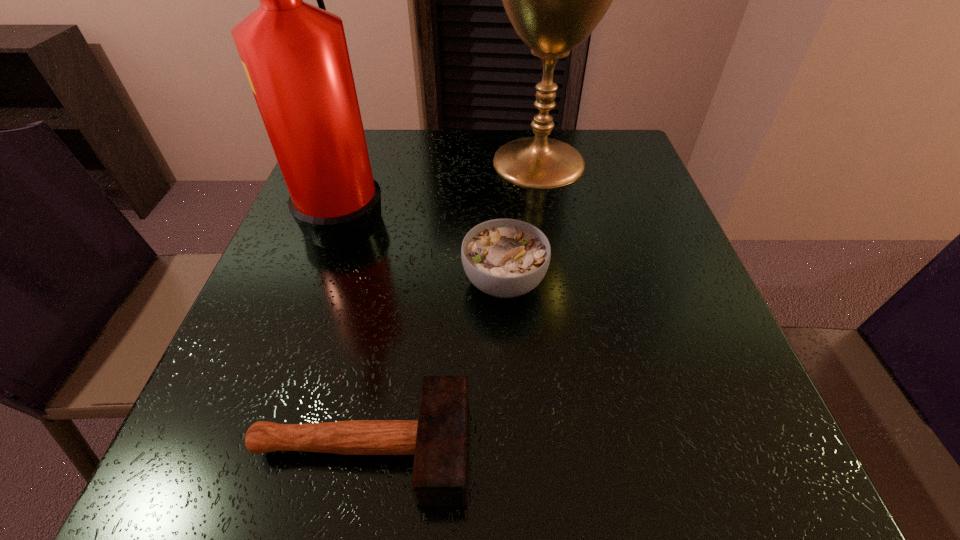
This screenshot has height=540, width=960. I want to click on vacant space in between the fire extinguisher and the second shortest object, so click(x=425, y=246).

Locate an element on the screen. free space between the third tallest object and the fire extinguisher is located at coordinates (425, 246).

Where is `object that stands as the second closest to the second shortest object`? object that stands as the second closest to the second shortest object is located at coordinates (295, 55).

Identify the location of object that is the closest to the mallet. This screenshot has width=960, height=540. (505, 258).

You are a GUI agent. You are given a task and a screenshot of the screen. Output one action in this format:
    pyautogui.click(x=<x>, y=<y>)
    Task: Click on the free location that satisfies the following two spatial constraints: 1. on the front side of the trophy cup; 2. at the spray nozzle of the fire extinguisher
    Image resolution: width=960 pixels, height=540 pixels.
    Given the screenshot: What is the action you would take?
    click(547, 212)